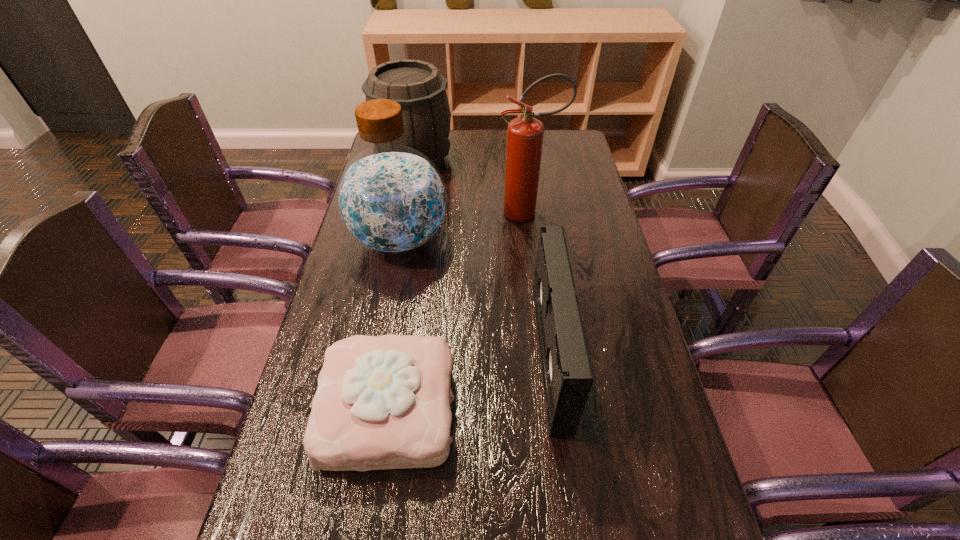
Locate an element on the screen. Image resolution: width=960 pixels, height=540 pixels. vacant space located 0.060m on the front of the farthest object is located at coordinates (408, 191).

This screenshot has width=960, height=540. Identify the location of vacant space located on the side of the fourth tallest object with visible spindles. (515, 354).

Find the location of a particular element. blank space located 0.120m on the side of the fourth tallest object with visible spindles is located at coordinates (491, 354).

This screenshot has width=960, height=540. Find the location of `free space located on the side of the fourth tallest object with visible spindles`. free space located on the side of the fourth tallest object with visible spindles is located at coordinates (380, 354).

Where is `free space located on the back of the cake`? free space located on the back of the cake is located at coordinates (404, 310).

In order to click on object that is at the far edge in this screenshot , I will do `click(419, 88)`.

Find the location of a particular element. The width and height of the screenshot is (960, 540). water jug that is at the left edge is located at coordinates (391, 199).

Identify the location of wine bucket at the left edge. (419, 88).

Locate an element on the screen. Image resolution: width=960 pixels, height=540 pixels. cake at the left edge is located at coordinates (383, 402).

At what (x,y) coordinates should I click in order to perform the action: click on object located in the right edge section of the desktop. Please return your answer as a coordinate pair (x, y). The height and width of the screenshot is (540, 960). Looking at the image, I should click on (525, 134).